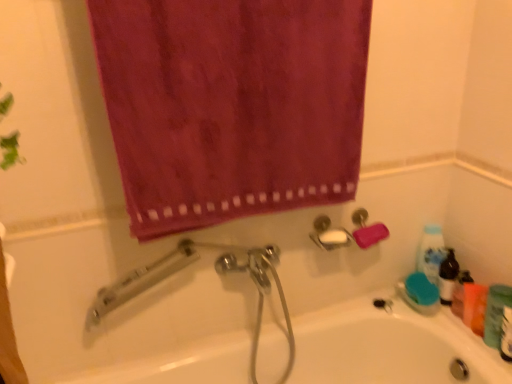
The height and width of the screenshot is (384, 512). In order to click on free location to the left of orange matte bottle at right, the second mouthwash in the right-to-left sequence in this screenshot , I will do `click(433, 324)`.